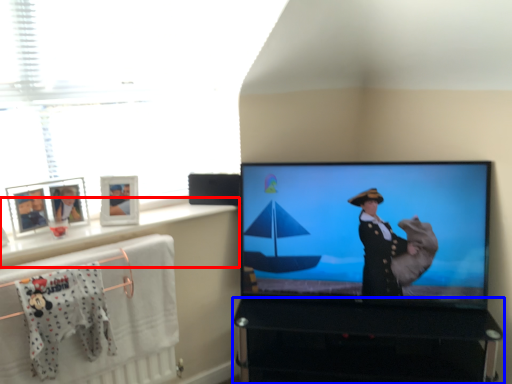
Question: Among these objects, which one is nearest to the camera, window sill (highlighted by a red box) or furniture (highlighted by a blue box)?

Choices:
 (A) window sill
 (B) furniture

Answer: (A)